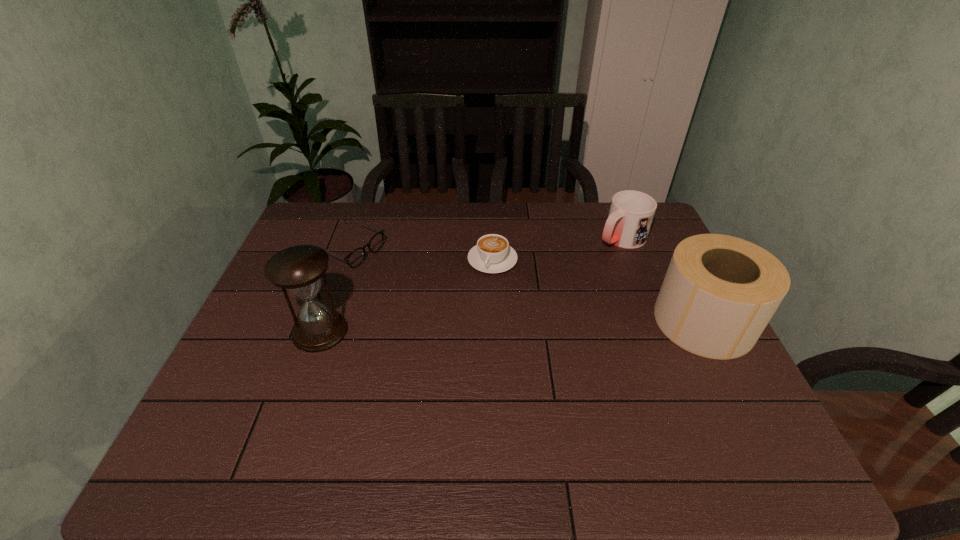
What are the coordinates of `vacant point located 0.330m through the lenses of the spectacles` in the screenshot? It's located at (465, 301).

I want to click on vacant region located 0.200m through the lenses of the spectacles, so click(428, 285).

The width and height of the screenshot is (960, 540). Find the location of `vacant space located through the lenses of the spectacles`. vacant space located through the lenses of the spectacles is located at coordinates (459, 299).

Image resolution: width=960 pixels, height=540 pixels. Identify the location of vacant space located 0.160m on the side of the third tallest object with the handle. click(x=572, y=269).

Where is `free spot located 0.370m on the side of the third tallest object with the handle`? This screenshot has width=960, height=540. free spot located 0.370m on the side of the third tallest object with the handle is located at coordinates (522, 301).

Locate an element on the screen. vacant space located 0.210m on the side of the third tallest object with the handle is located at coordinates (561, 276).

In order to click on spectacles positioned at the far edge in this screenshot , I will do `click(355, 258)`.

Where is `mug situated at the far edge`? The height and width of the screenshot is (540, 960). mug situated at the far edge is located at coordinates (631, 213).

Identify the location of hourglass that is at the left edge. (298, 269).

At what (x,y) coordinates should I click in order to perform the action: click on spectacles present at the left edge. Please return your answer as a coordinate pair (x, y). Looking at the image, I should click on (355, 258).